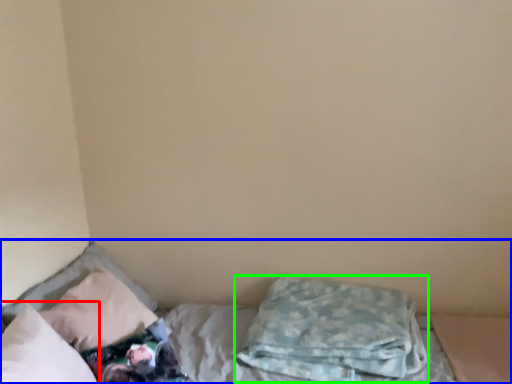
Question: Which is nearer to the pillow (highlighted by a red box)? bed (highlighted by a blue box) or pillow (highlighted by a green box).

Choices:
 (A) bed
 (B) pillow

Answer: (A)